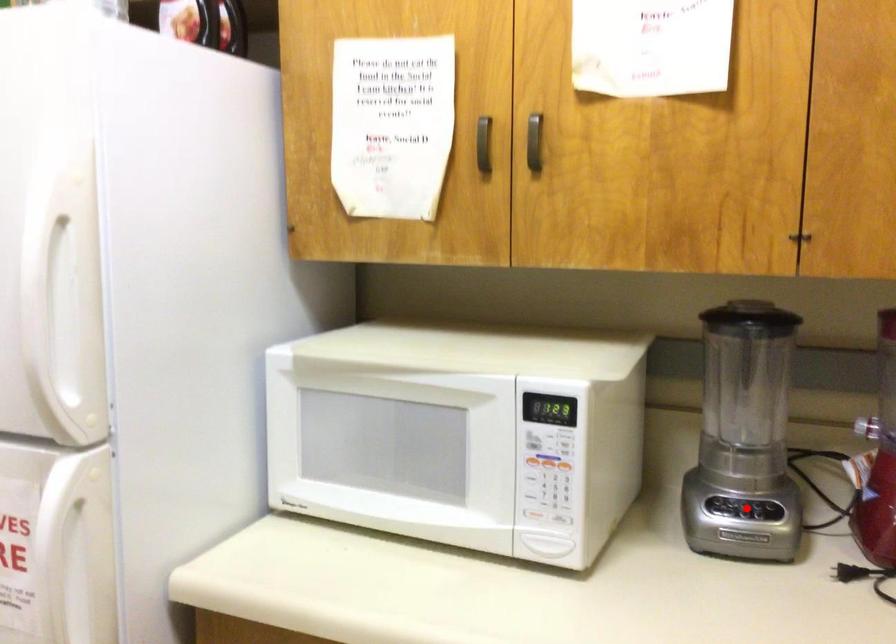
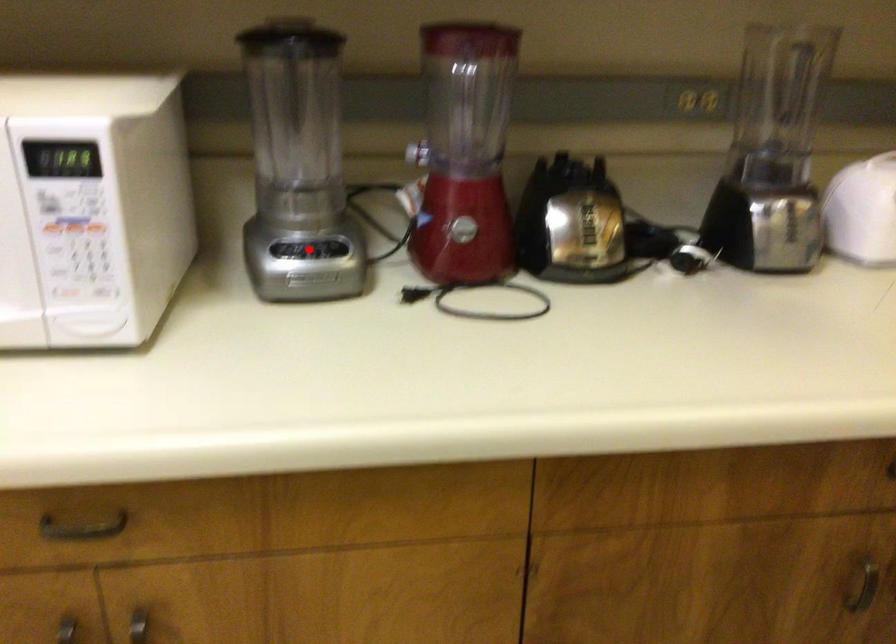
I am providing you with two images of the same scene from different viewpoints. A red point is marked on the first image and another point is marked on the second image. Do the highlighted points in image1 and image2 indicate the same real-world spot?

Yes